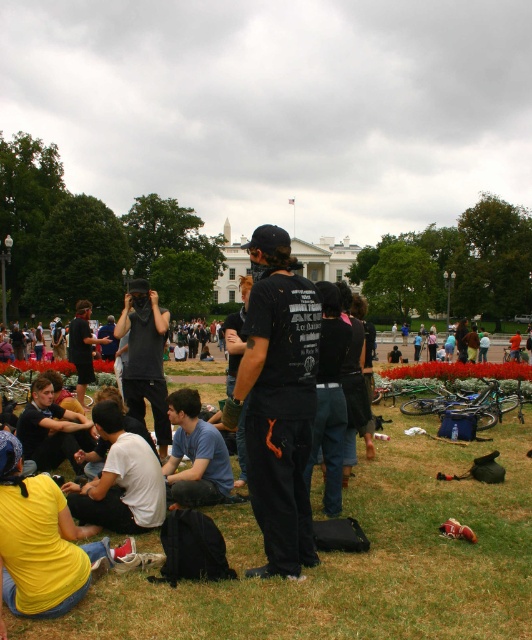
Question: Does dark gray hoodie at lower left appear on the right side of dark gray hoodie at center?

Choices:
 (A) no
 (B) yes

Answer: (B)

Question: Among these points, which one is nearest to the camera?

Choices:
 (A) (223, 332)
 (B) (408, 513)
 (C) (263, 225)
 (D) (82, 403)

Answer: (B)

Question: Which point is farther to the camera?

Choices:
 (A) (196, 452)
 (B) (275, 324)
 (C) (480, 600)

Answer: (A)

Question: Which point appears farthest from the camera in this image?

Choices:
 (A) (203, 433)
 (B) (244, 339)
 (C) (263, 502)
 (D) (135, 444)

Answer: (B)

Question: Can you confirm if dark gray hoodie at lower left is positioned below dark gray hoodie at center?

Choices:
 (A) yes
 (B) no

Answer: (A)

Question: Is white matte shirt at lower left thinner than dark gray hoodie at center?

Choices:
 (A) yes
 (B) no

Answer: (A)